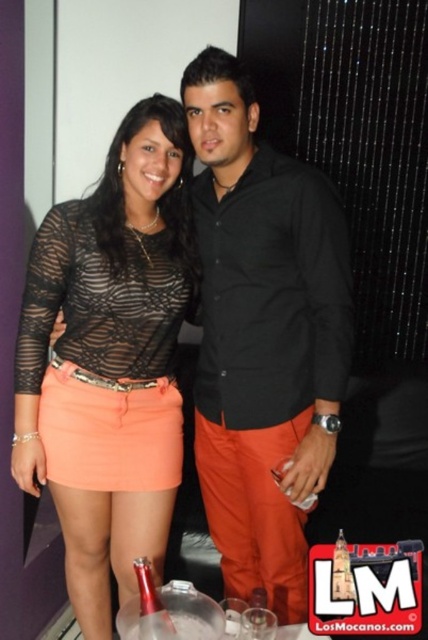
You are at a party and want to find the black matte shirt at center. Based on the coordinates provided, where should you look in the image?

The black matte shirt at center is located at point (262, 337) in the image.